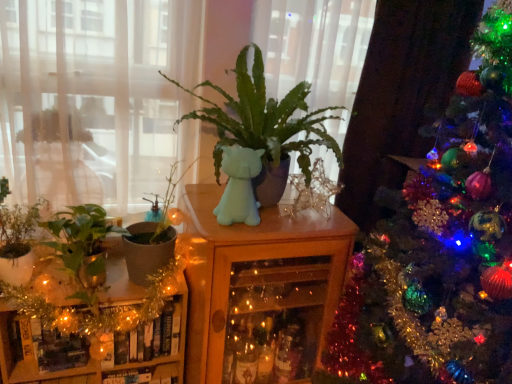
The height and width of the screenshot is (384, 512). What do you see at coordinates (264, 119) in the screenshot? I see `green matte plant at center, acting as the fourth houseplant starting from the left` at bounding box center [264, 119].

What do you see at coordinates (152, 239) in the screenshot? This screenshot has width=512, height=384. I see `green matte pot at left, marked as the third houseplant in a left-to-right arrangement` at bounding box center [152, 239].

This screenshot has height=384, width=512. What do you see at coordinates (17, 238) in the screenshot?
I see `green matte plant at left, the 4th houseplant positioned from the right` at bounding box center [17, 238].

At what (x,y) coordinates should I click in order to perform the action: click on shiny green christmas tree at right. Please return your answer as a coordinate pair (x, y). Looking at the image, I should click on (440, 244).

Which point is more distant from viewer, [212,110] or [139,48]?

Positioned behind is point [139,48].

Would you say green matte plant at center, acting as the fourth houseplant starting from the left, is to the left or to the right of transparent glass window at upper left in the picture?

green matte plant at center, acting as the fourth houseplant starting from the left, is to the right of transparent glass window at upper left.

Is green matte plant at center, acting as the fourth houseplant starting from the left, completely or partially outside of transparent glass window at upper left?

Yes.

How many degrees apart are the facing directions of green matte plant at center, which is counted as the first houseplant, starting from the right, and transparent glass window at upper left?

They differ by 0.421 degrees in their facing directions.

Which object is wider, green matte plant at left, positioned as the 2th houseplant in left-to-right order, or wooden cabinet at center, the 1th furniture positioned from the right?

Wider between the two is wooden cabinet at center, the 1th furniture positioned from the right.

From a real-world perspective, is green matte plant at left, which is the 3th houseplant from right to left, below wooden cabinet at center, the 1th furniture positioned from the right?

Incorrect, from a real-world perspective, green matte plant at left, which is the 3th houseplant from right to left, is higher than wooden cabinet at center, the 1th furniture positioned from the right.

Is green matte plant at left, positioned as the 2th houseplant in left-to-right order, at the right side of wooden cabinet at center, positioned as the 2th furniture in left-to-right order?

Incorrect, green matte plant at left, positioned as the 2th houseplant in left-to-right order, is not on the right side of wooden cabinet at center, positioned as the 2th furniture in left-to-right order.

From the image's perspective, does green matte plant at left, which is the 3th houseplant from right to left, appear higher than wooden cabinet at center, the 1th furniture positioned from the right?

Yes.

Relative to green matte pot at left, the second houseplant in the right-to-left sequence, is shiny green christmas tree at right in front or behind?

shiny green christmas tree at right is in front of green matte pot at left, the second houseplant in the right-to-left sequence.

Is shiny green christmas tree at right facing towards green matte pot at left, marked as the third houseplant in a left-to-right arrangement?

No, shiny green christmas tree at right is not aimed at green matte pot at left, marked as the third houseplant in a left-to-right arrangement.

The image size is (512, 384). Identify the location of the 2nd houseplant to the left of the shiny green christmas tree at right, starting your count from the anchor. (152, 239).

From a real-world perspective, relative to green matte pot at left, the second houseplant in the right-to-left sequence, is shiny green christmas tree at right vertically above or below?

shiny green christmas tree at right is above green matte pot at left, the second houseplant in the right-to-left sequence.

Which is more to the left, green matte pot at left, the second houseplant in the right-to-left sequence, or wooden cabinet at center, the 1th furniture positioned from the right?

Positioned to the left is green matte pot at left, the second houseplant in the right-to-left sequence.

Is green matte pot at left, marked as the third houseplant in a left-to-right arrangement, in front of or behind wooden cabinet at center, positioned as the 2th furniture in left-to-right order, in the image?

green matte pot at left, marked as the third houseplant in a left-to-right arrangement, is positioned farther from the viewer than wooden cabinet at center, positioned as the 2th furniture in left-to-right order.

Is green matte pot at left, the second houseplant in the right-to-left sequence, next to wooden cabinet at center, positioned as the 2th furniture in left-to-right order, and touching it?

There is a gap between green matte pot at left, the second houseplant in the right-to-left sequence, and wooden cabinet at center, positioned as the 2th furniture in left-to-right order.

Where is `the 2nd furniture positioned below the green matte plant at center, acting as the fourth houseplant starting from the left (from a real-world perspective)`? the 2nd furniture positioned below the green matte plant at center, acting as the fourth houseplant starting from the left (from a real-world perspective) is located at coordinates (111, 315).

Is green matte plant at center, acting as the fourth houseplant starting from the left, at the back of gold tinsel garland at lower left, the second furniture from the right?

gold tinsel garland at lower left, the second furniture from the right, is not turned away from green matte plant at center, acting as the fourth houseplant starting from the left.

Is green matte plant at center, acting as the fourth houseplant starting from the left, turned away from gold tinsel garland at lower left, the 1th furniture in the left-to-right sequence?

No, green matte plant at center, acting as the fourth houseplant starting from the left, is not facing away from gold tinsel garland at lower left, the 1th furniture in the left-to-right sequence.

Can you tell me how much green matte plant at center, acting as the fourth houseplant starting from the left, and gold tinsel garland at lower left, the 1th furniture in the left-to-right sequence, differ in facing direction?

They differ by 1.33 degrees in their facing directions.

Is gold tinsel garland at lower left, the second furniture from the right, completely or partially inside green matte plant at center, acting as the fourth houseplant starting from the left?

That's incorrect, gold tinsel garland at lower left, the second furniture from the right, is not inside green matte plant at center, acting as the fourth houseplant starting from the left.

From a real-world perspective, which is physically below, green matte pot at left, marked as the third houseplant in a left-to-right arrangement, or green matte plant at left, which is the 3th houseplant from right to left?

green matte plant at left, which is the 3th houseplant from right to left, is physically lower.

What are the coordinates of `the 1st houseplant counting from the left side of the green matte pot at left, the second houseplant in the right-to-left sequence` in the screenshot? It's located at (82, 242).

Would you say green matte pot at left, marked as the third houseplant in a left-to-right arrangement, is a long distance from green matte plant at left, positioned as the 2th houseplant in left-to-right order?

No, green matte pot at left, marked as the third houseplant in a left-to-right arrangement, is in close proximity to green matte plant at left, positioned as the 2th houseplant in left-to-right order.

Considering the sizes of objects green matte pot at left, the second houseplant in the right-to-left sequence, and green matte plant at left, positioned as the 2th houseplant in left-to-right order, in the image provided, who is thinner, green matte pot at left, the second houseplant in the right-to-left sequence, or green matte plant at left, positioned as the 2th houseplant in left-to-right order,?

Thinner between the two is green matte pot at left, the second houseplant in the right-to-left sequence.

Where is `the 2nd houseplant in front of the transparent glass window at upper left, counting from the anchor's position`? This screenshot has height=384, width=512. the 2nd houseplant in front of the transparent glass window at upper left, counting from the anchor's position is located at coordinates (264, 119).

Starting from the wooden cabinet at center, the 1th furniture positioned from the right, which houseplant is the 2nd one to the left? Please provide its 2D coordinates.

[(82, 242)]

Which object lies nearer to the anchor point transparent glass window at upper left, wooden cabinet at center, positioned as the 2th furniture in left-to-right order, or green matte plant at left, positioned as the 2th houseplant in left-to-right order?

green matte plant at left, positioned as the 2th houseplant in left-to-right order.

When comparing their distances from green matte pot at left, the second houseplant in the right-to-left sequence, does green matte plant at left, which is the 3th houseplant from right to left, or gold tinsel garland at lower left, the 1th furniture in the left-to-right sequence, seem further?

Among the two, gold tinsel garland at lower left, the 1th furniture in the left-to-right sequence, is located further to green matte pot at left, the second houseplant in the right-to-left sequence.

When comparing their distances from shiny green christmas tree at right, does wooden cabinet at center, positioned as the 2th furniture in left-to-right order, or green matte plant at left, the 4th houseplant positioned from the right, seem further?

green matte plant at left, the 4th houseplant positioned from the right.

Considering their positions, is shiny green christmas tree at right positioned further to green matte pot at left, marked as the third houseplant in a left-to-right arrangement, than wooden cabinet at center, the 1th furniture positioned from the right?

shiny green christmas tree at right lies further to green matte pot at left, marked as the third houseplant in a left-to-right arrangement, than the other object.

Looking at the image, which one is located further to wooden cabinet at center, the 1th furniture positioned from the right, green matte plant at center, acting as the fourth houseplant starting from the left, or green matte pot at left, marked as the third houseplant in a left-to-right arrangement?

green matte pot at left, marked as the third houseplant in a left-to-right arrangement, is positioned further to the anchor wooden cabinet at center, the 1th furniture positioned from the right.

When comparing their distances from green matte plant at left, positioned as the 2th houseplant in left-to-right order, does gold tinsel garland at lower left, the 1th furniture in the left-to-right sequence, or transparent glass window at upper left seem further?

transparent glass window at upper left is positioned further to the anchor green matte plant at left, positioned as the 2th houseplant in left-to-right order.

Looking at the image, which one is located further to transparent glass window at upper left, green matte pot at left, marked as the third houseplant in a left-to-right arrangement, or green matte plant at left, the 4th houseplant positioned from the right?

Among the two, green matte plant at left, the 4th houseplant positioned from the right, is located further to transparent glass window at upper left.

Based on the photo, from the image, which object appears to be nearer to green matte pot at left, the second houseplant in the right-to-left sequence, green matte plant at center, acting as the fourth houseplant starting from the left, or gold tinsel garland at lower left, the second furniture from the right?

gold tinsel garland at lower left, the second furniture from the right.

Identify the location of houseplant between green matte plant at left, positioned as the 2th houseplant in left-to-right order, and wooden cabinet at center, positioned as the 2th furniture in left-to-right order, in the horizontal direction. This screenshot has height=384, width=512. (152, 239).

The height and width of the screenshot is (384, 512). In order to click on furniture between gold tinsel garland at lower left, the 1th furniture in the left-to-right sequence, and shiny green christmas tree at right in this screenshot , I will do `click(260, 290)`.

This screenshot has height=384, width=512. Find the location of `furniture between transparent glass window at upper left and shiny green christmas tree at right in the horizontal direction`. furniture between transparent glass window at upper left and shiny green christmas tree at right in the horizontal direction is located at coordinates (260, 290).

Where is `window situated between green matte plant at left, arranged as the first houseplant when viewed from the left, and wooden cabinet at center, the 1th furniture positioned from the right, from left to right`? window situated between green matte plant at left, arranged as the first houseplant when viewed from the left, and wooden cabinet at center, the 1th furniture positioned from the right, from left to right is located at coordinates (96, 99).